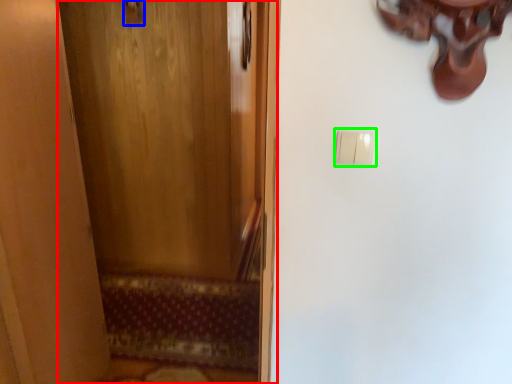
Question: Considering the real-world distances, which object is closest to door (highlighted by a red box)? door handle (highlighted by a blue box) or light switch (highlighted by a green box).

Choices:
 (A) door handle
 (B) light switch

Answer: (A)